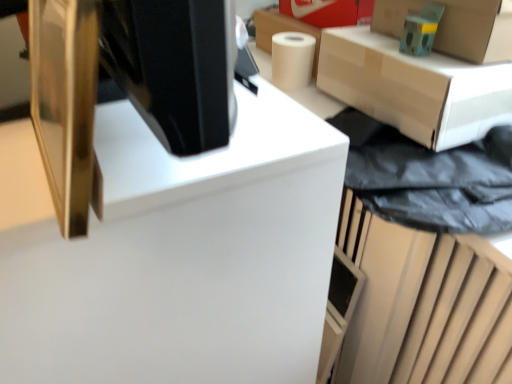
Question: Does gold metallic monitor at upper left have a lesser height compared to white matte paper towel at upper right?

Choices:
 (A) yes
 (B) no

Answer: (B)

Question: Could you tell me if gold metallic monitor at upper left is facing white matte paper towel at upper right?

Choices:
 (A) no
 (B) yes

Answer: (A)

Question: Considering the relative sizes of gold metallic monitor at upper left and white matte paper towel at upper right in the image provided, is gold metallic monitor at upper left wider than white matte paper towel at upper right?

Choices:
 (A) yes
 (B) no

Answer: (B)

Question: Is gold metallic monitor at upper left positioned before white matte paper towel at upper right?

Choices:
 (A) no
 (B) yes

Answer: (B)

Question: From the image's perspective, is gold metallic monitor at upper left under white matte paper towel at upper right?

Choices:
 (A) yes
 (B) no

Answer: (A)

Question: In the image, is white matte paper towel at upper right positioned in front of or behind cardboard box at upper right?

Choices:
 (A) behind
 (B) front

Answer: (A)

Question: Is white matte paper towel at upper right taller or shorter than cardboard box at upper right?

Choices:
 (A) tall
 (B) short

Answer: (B)

Question: Considering the positions of white matte paper towel at upper right and cardboard box at upper right in the image, is white matte paper towel at upper right bigger or smaller than cardboard box at upper right?

Choices:
 (A) big
 (B) small

Answer: (B)

Question: Is white matte paper towel at upper right to the left or to the right of cardboard box at upper right in the image?

Choices:
 (A) right
 (B) left

Answer: (B)

Question: From the image's perspective, relative to teal matte toy at upper right, is matte cardboard box at upper right above or below?

Choices:
 (A) above
 (B) below

Answer: (B)

Question: In terms of height, does matte cardboard box at upper right look taller or shorter compared to teal matte toy at upper right?

Choices:
 (A) tall
 (B) short

Answer: (A)

Question: From a real-world perspective, relative to teal matte toy at upper right, is matte cardboard box at upper right vertically above or below?

Choices:
 (A) below
 (B) above

Answer: (A)

Question: Is matte cardboard box at upper right wider or thinner than teal matte toy at upper right?

Choices:
 (A) wide
 (B) thin

Answer: (A)

Question: From their relative heights in the image, would you say teal matte toy at upper right is taller or shorter than white matte paper towel at upper right?

Choices:
 (A) short
 (B) tall

Answer: (A)

Question: Considering their positions, is teal matte toy at upper right located in front of or behind white matte paper towel at upper right?

Choices:
 (A) front
 (B) behind

Answer: (A)